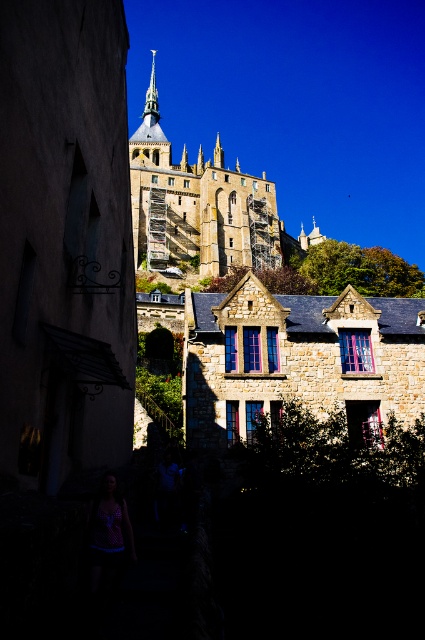
Question: Does stone textured house at center come in front of stone medieval castle at upper center?

Choices:
 (A) no
 (B) yes

Answer: (B)

Question: Which point is farther to the camera?

Choices:
 (A) stone textured house at center
 (B) stone medieval castle at upper center
 (C) smooth gold spire at upper center

Answer: (C)

Question: Observing the image, what is the correct spatial positioning of stone textured house at center in reference to smooth gold spire at upper center?

Choices:
 (A) below
 (B) above

Answer: (A)

Question: Which object is farther from the camera taking this photo?

Choices:
 (A) stone textured house at center
 (B) smooth gold spire at upper center
 (C) stone medieval castle at upper center

Answer: (B)

Question: Does stone textured house at center have a lesser width compared to smooth gold spire at upper center?

Choices:
 (A) no
 (B) yes

Answer: (A)

Question: Considering the real-world distances, which object is closest to the stone textured house at center?

Choices:
 (A) smooth gold spire at upper center
 (B) stone medieval castle at upper center

Answer: (B)